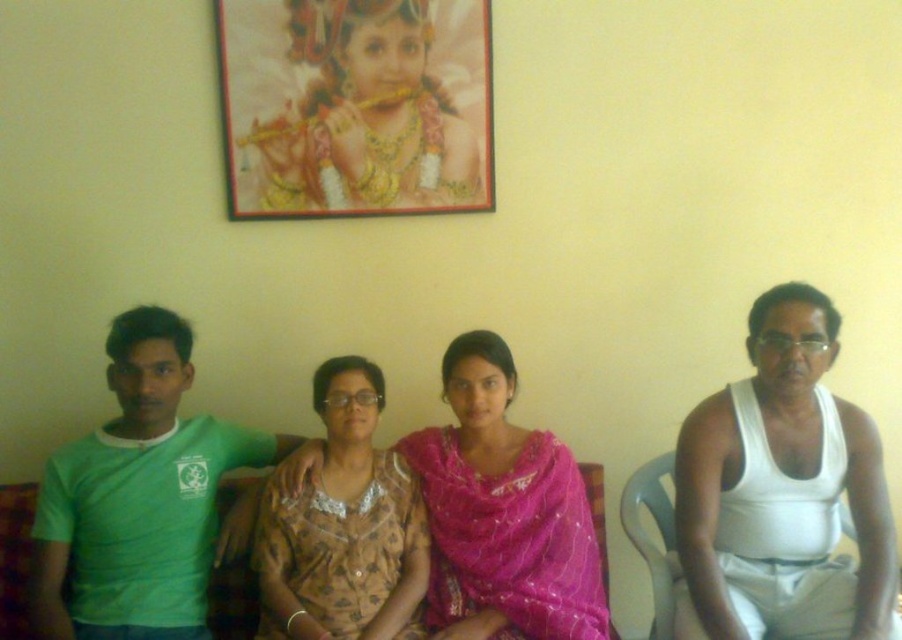
Question: Does green matte t-shirt at left appear over pink satin saree at center?

Choices:
 (A) no
 (B) yes

Answer: (B)

Question: Does brown printed dress at center appear on the right side of green cotton shirt at left?

Choices:
 (A) no
 (B) yes

Answer: (A)

Question: Which of the following is the farthest from the observer?

Choices:
 (A) green matte t-shirt at left
 (B) pink satin saree at center
 (C) green cotton shirt at left

Answer: (B)

Question: Does gold-framed portrait at upper center have a greater width compared to green cotton shirt at left?

Choices:
 (A) no
 (B) yes

Answer: (B)

Question: Which of the following is the farthest from the observer?

Choices:
 (A) (160, 465)
 (B) (357, 538)

Answer: (A)

Question: Which point is closer to the camera taking this photo?

Choices:
 (A) (706, 513)
 (B) (503, 550)
 (C) (286, 172)
 (D) (373, 470)

Answer: (A)